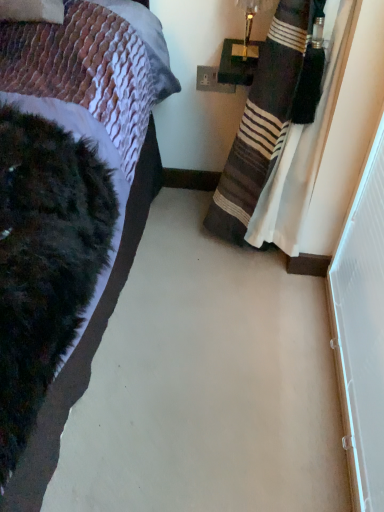
Question: Does white plastic screen door at right have a lesser height compared to white plastic power outlet at upper center?

Choices:
 (A) no
 (B) yes

Answer: (A)

Question: Is the position of white plastic screen door at right less distant than that of white plastic power outlet at upper center?

Choices:
 (A) no
 (B) yes

Answer: (B)

Question: Is white plastic screen door at right at the right side of white plastic power outlet at upper center?

Choices:
 (A) no
 (B) yes

Answer: (B)

Question: Is white plastic screen door at right to the left of white plastic power outlet at upper center from the viewer's perspective?

Choices:
 (A) yes
 (B) no

Answer: (B)

Question: Is white plastic screen door at right wider than white plastic power outlet at upper center?

Choices:
 (A) no
 (B) yes

Answer: (B)

Question: Is white plastic screen door at right situated inside white plastic power outlet at upper center or outside?

Choices:
 (A) inside
 (B) outside

Answer: (B)

Question: Is point (336, 333) closer or farther from the camera than point (205, 67)?

Choices:
 (A) farther
 (B) closer

Answer: (B)

Question: Visually, is white plastic screen door at right positioned to the left or to the right of white plastic power outlet at upper center?

Choices:
 (A) left
 (B) right

Answer: (B)

Question: From a real-world perspective, relative to white plastic power outlet at upper center, is white plastic screen door at right vertically above or below?

Choices:
 (A) below
 (B) above

Answer: (A)

Question: In terms of height, does striped fabric curtain at right look taller or shorter compared to metallic gold lamp at upper right?

Choices:
 (A) short
 (B) tall

Answer: (B)

Question: From a real-world perspective, is striped fabric curtain at right above or below metallic gold lamp at upper right?

Choices:
 (A) below
 (B) above

Answer: (A)

Question: Considering the relative positions of striped fabric curtain at right and metallic gold lamp at upper right in the image provided, is striped fabric curtain at right to the left or to the right of metallic gold lamp at upper right?

Choices:
 (A) left
 (B) right

Answer: (B)

Question: From the image's perspective, is striped fabric curtain at right located above or below metallic gold lamp at upper right?

Choices:
 (A) below
 (B) above

Answer: (A)

Question: In terms of size, does white plastic power outlet at upper center appear bigger or smaller than metallic gold lamp at upper right?

Choices:
 (A) big
 (B) small

Answer: (B)

Question: Considering their positions, is white plastic power outlet at upper center located in front of or behind metallic gold lamp at upper right?

Choices:
 (A) behind
 (B) front

Answer: (A)